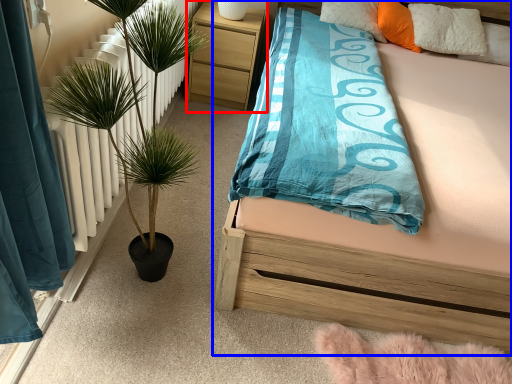
Question: Which point is further to the camera, nightstand (highlighted by a red box) or bed (highlighted by a blue box)?

Choices:
 (A) nightstand
 (B) bed

Answer: (A)